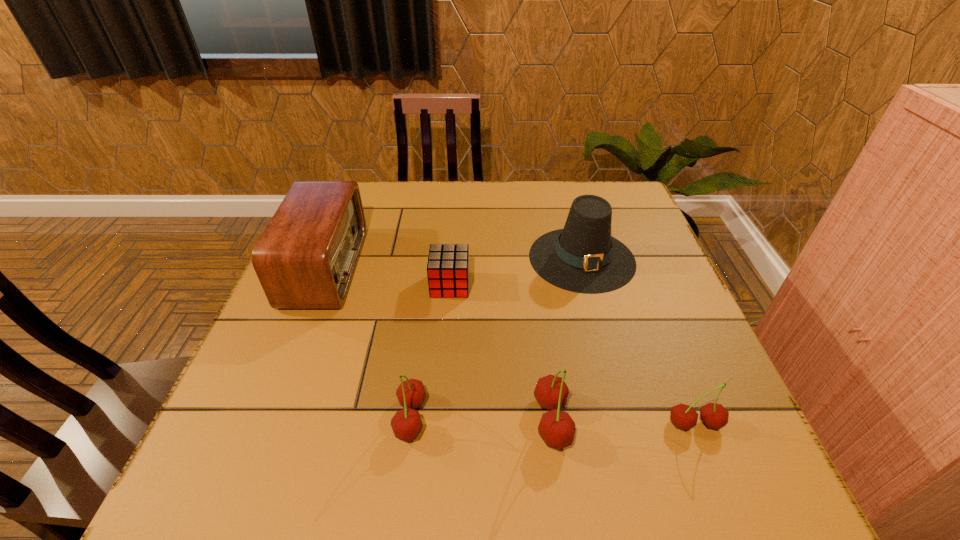
You are a GUI agent. You are given a task and a screenshot of the screen. Output one action in this format:
    pyautogui.click(x=<x>, y=<y>)
    Task: Click on the vacant space at the far edge
    This screenshot has width=960, height=540.
    Given the screenshot: What is the action you would take?
    pyautogui.click(x=492, y=185)

Identify the location of vacant region at the left edge. The height and width of the screenshot is (540, 960). (330, 341).

This screenshot has height=540, width=960. In the image, there is a desktop. Identify the location of vacant area at the right edge. (627, 318).

You are a GUI agent. You are given a task and a screenshot of the screen. Output one action in this format:
    pyautogui.click(x=<x>, y=<y>)
    Task: Click on the vacant region at the far left corner
    
    Given the screenshot: What is the action you would take?
    pos(366,192)

What are the coordinates of `vacant position at the near left corner of the desktop` in the screenshot? It's located at (219, 435).

This screenshot has width=960, height=540. I want to click on blank region between the second cherry from left to right and the hat, so click(567, 340).

Where is `free space between the second cherry from right to left and the leftmost object`? This screenshot has height=540, width=960. free space between the second cherry from right to left and the leftmost object is located at coordinates point(439,345).

You are a GUI agent. You are given a task and a screenshot of the screen. Output one action in this format:
    pyautogui.click(x=<x>, y=<y>)
    Task: Click on the free point between the shortest object and the hat
    Image resolution: width=960 pixels, height=540 pixels.
    Given the screenshot: What is the action you would take?
    pyautogui.click(x=516, y=272)

At what (x,y) coordinates should I click in order to perform the action: click on vacant point located between the shortest object and the second shortest object. Please return your answer as a coordinate pair (x, y). The image size is (960, 540). Looking at the image, I should click on (572, 354).

The height and width of the screenshot is (540, 960). What are the coordinates of `free spot between the second tallest cherry and the second cherry from right to left` in the screenshot? It's located at (481, 420).